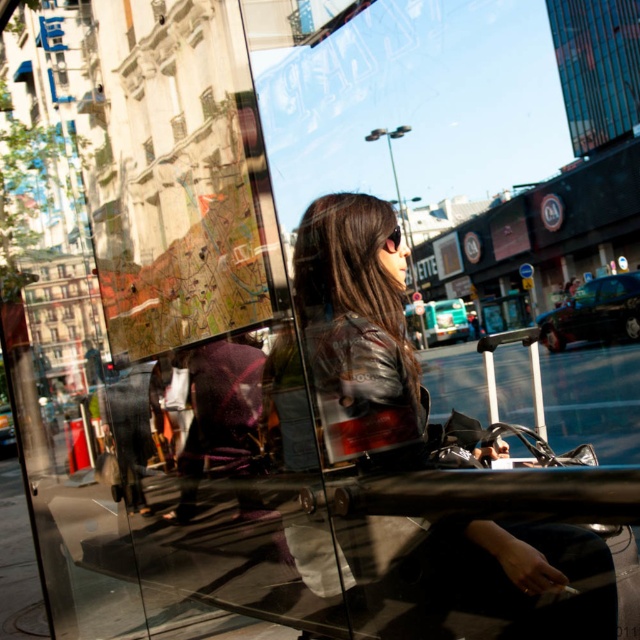
You are a fashion designer observing the image. You need to decide which item, the leather jacket at center or the black plastic sunglasses at center, would require more fabric or material in its construction. Based on the scene, which item would that be?

The leather jacket at center has a larger size compared to the black plastic sunglasses at center, so the leather jacket at center would require more fabric or material in its construction.

You are a fashion designer observing the image and want to create a design that matches the layers shown. Since the leather jacket at center and the black plastic sunglasses at center are both visible, which item should you place in the foreground of your design to maintain the layered look?

The leather jacket at center should be placed in the foreground because it is closer to the viewer than the black plastic sunglasses at center, creating the layered effect seen in the image.

You are a fashion designer observing the image. You need to determine the spatial relationship between the leather jacket at center and the black plastic sunglasses at center. Which object is positioned higher in the image?

The black plastic sunglasses at center are positioned higher than the leather jacket at center because the leather jacket at center is below the black plastic sunglasses at center.